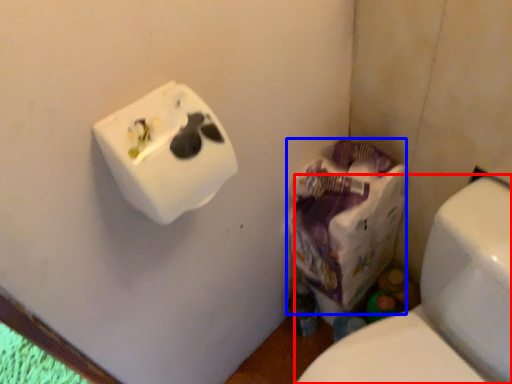
Question: Among these objects, which one is nearest to the camera, toilet (highlighted by a red box) or paper bag (highlighted by a blue box)?

Choices:
 (A) toilet
 (B) paper bag

Answer: (A)